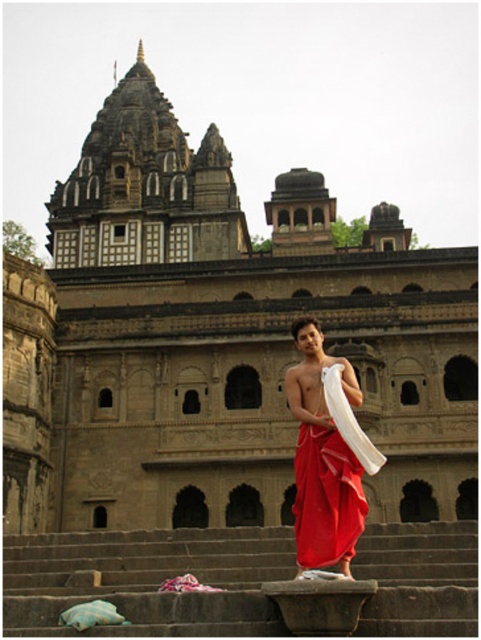
You are a visitor standing at the entrance of the temple. You see the smooth stone steps at lower center and the red silk dhoti at center. How far apart are these two objects?

The smooth stone steps at lower center and the red silk dhoti at center are 7.61 meters apart.

Looking at this image, you are standing at the base of the temple and want to reach the entrance at the dark gray stone hindu temple at upper center. Which direction should you move relative to the smooth stone steps at lower center?

You should move to the left relative to the smooth stone steps at lower center because the dark gray stone hindu temple at upper center is positioned to the left of the smooth stone steps at lower center.

You are an architect visiting the temple and need to determine the spatial relationship between the smooth stone steps at lower center and the dark gray stone hindu temple at upper center. Which object is larger in size?

The dark gray stone hindu temple at upper center is larger than the smooth stone steps at lower center.